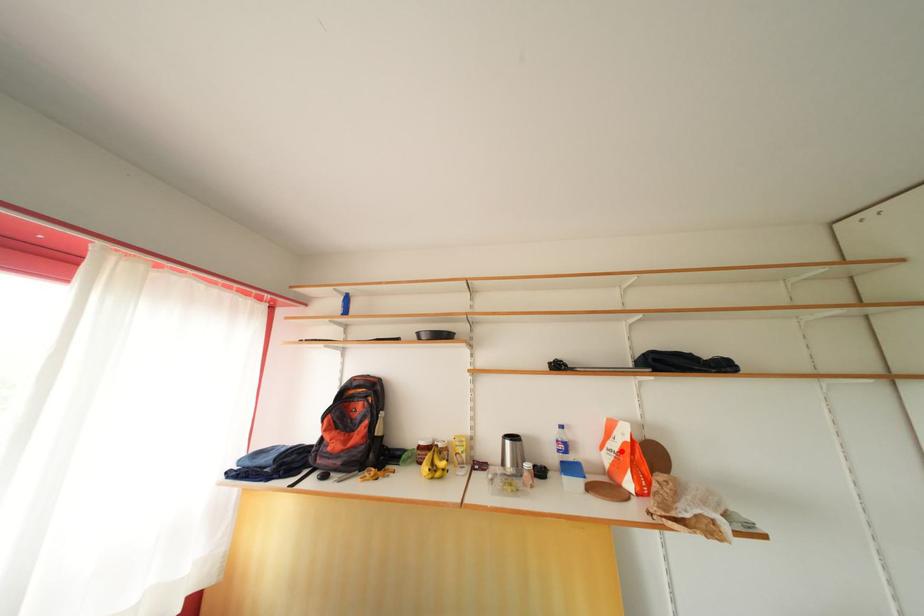
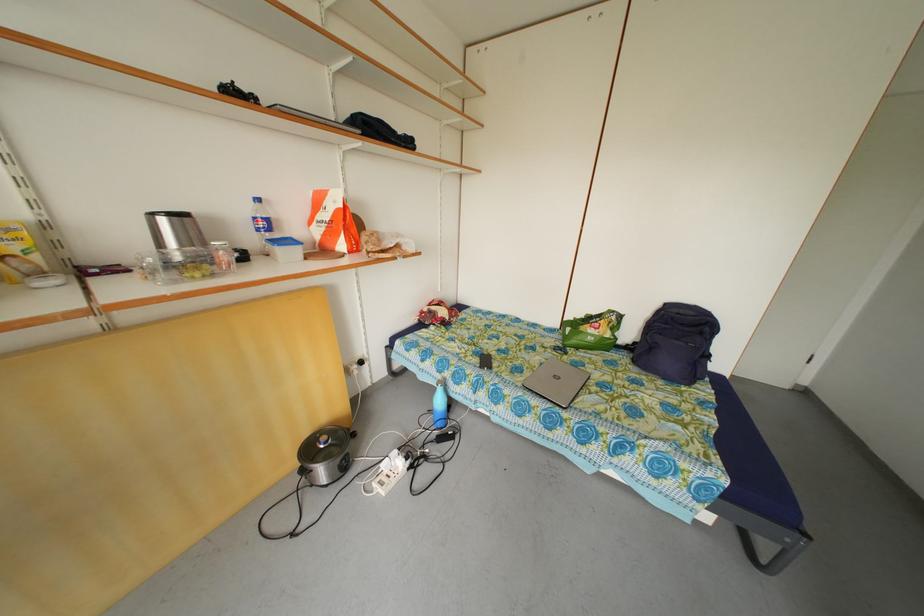
Find the pixel in the second image that matches the highlighted location in the first image.

(332, 222)